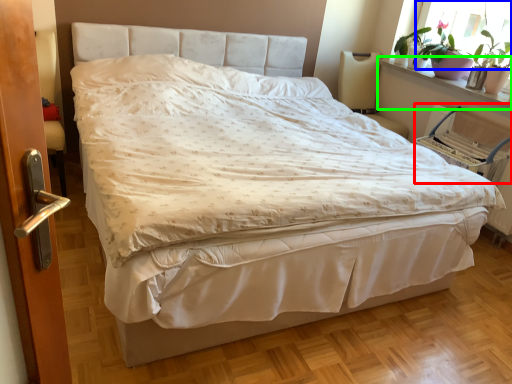
Question: Which is farther away from armchair (highlighted by a red box)? window screen (highlighted by a blue box) or window sill (highlighted by a green box)?

Choices:
 (A) window screen
 (B) window sill

Answer: (A)